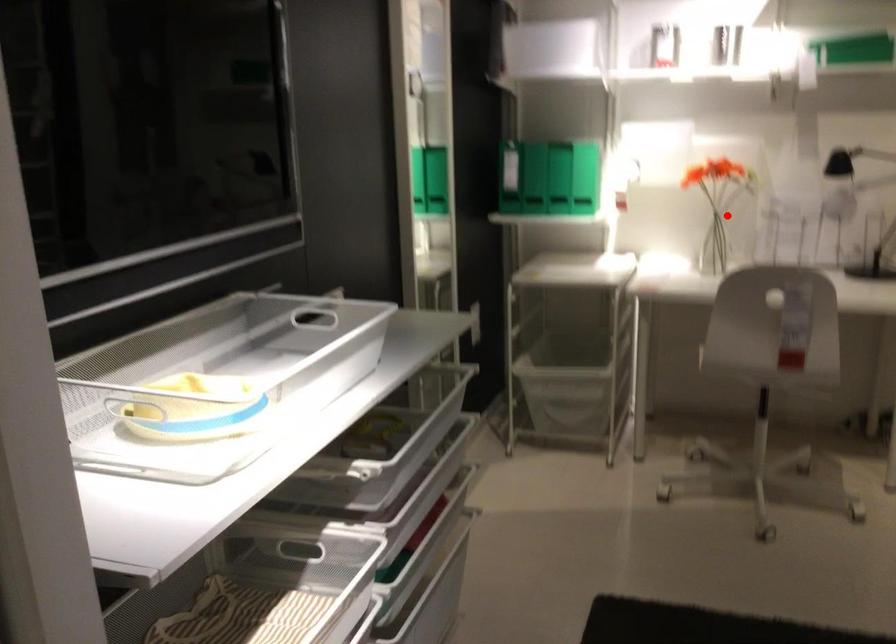
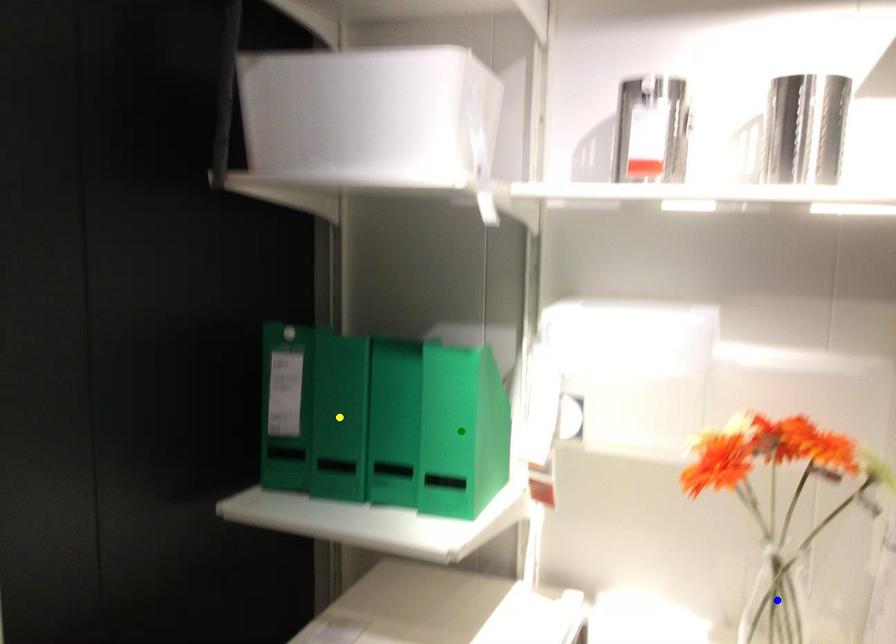
Question: I am providing you with two images of the same scene from different viewpoints. A red point is marked on the first image. You are given multiple points on the second image. In image 2, which mark is for the same physical point as the one in image 1?

Choices:
 (A) blue point
 (B) green point
 (C) yellow point

Answer: (A)